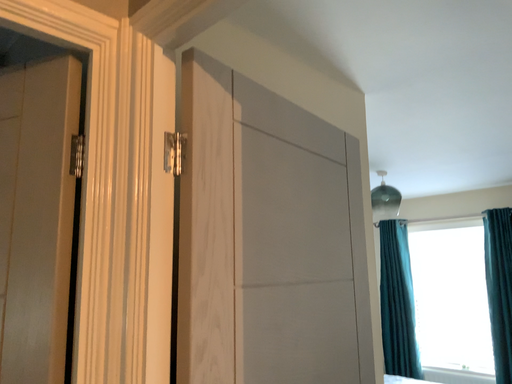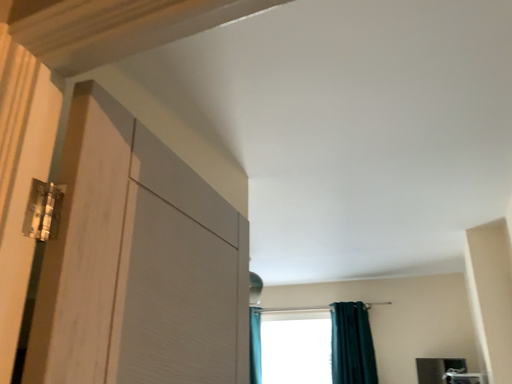
Question: Which way did the camera rotate in the video?

Choices:
 (A) rotated right
 (B) rotated left

Answer: (A)